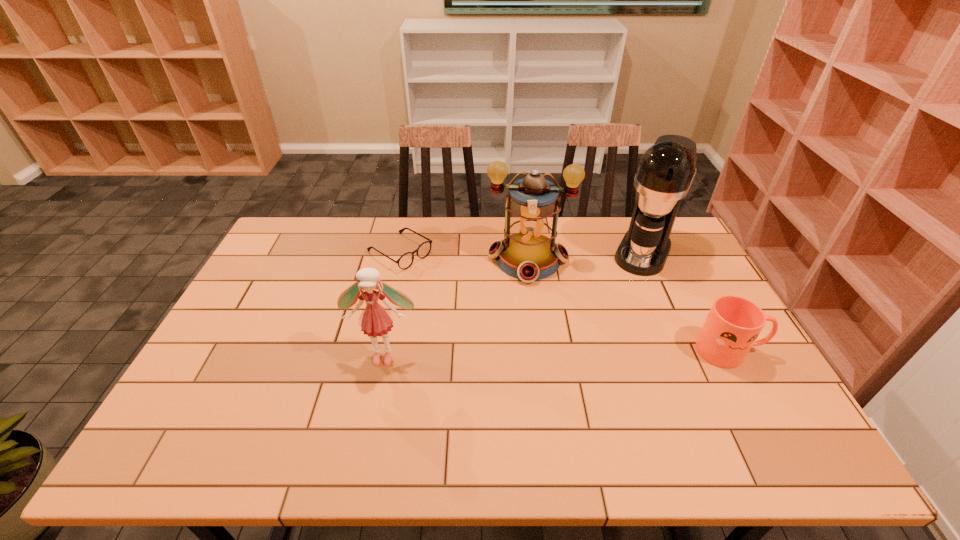
Where is `vacant space on the desktop that is between the third tallest object and the mug and is positioned on the front-facing side of the fourth shortest object`? The image size is (960, 540). vacant space on the desktop that is between the third tallest object and the mug and is positioned on the front-facing side of the fourth shortest object is located at coordinates (524, 354).

Identify the location of vacant space on the desktop that is between the doll and the fourth tallest object and is positioned on the front-facing side of the spectacles. (559, 353).

At what (x,y) coordinates should I click in order to perform the action: click on free space on the desktop that is between the doll and the mug and is positioned place cup under the spout of the coffee maker. Please return your answer as a coordinate pair (x, y). The image size is (960, 540). Looking at the image, I should click on (596, 353).